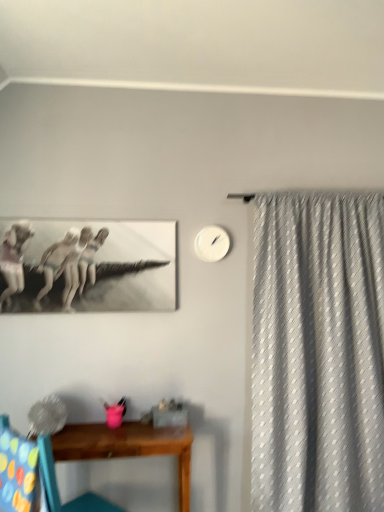
Question: In terms of width, does wooden chair at lower left look wider or thinner when compared to multicolored fabric swivel chair at lower left?

Choices:
 (A) thin
 (B) wide

Answer: (B)

Question: Based on their positions, is wooden chair at lower left located to the left or right of multicolored fabric swivel chair at lower left?

Choices:
 (A) right
 (B) left

Answer: (A)

Question: Estimate the real-world distances between objects in this image. Which object is farther from the wooden table at lower center?

Choices:
 (A) white matte clock at upper center
 (B) white textured curtain at right
 (C) wooden chair at lower left
 (D) multicolored fabric swivel chair at lower left

Answer: (A)

Question: Which object is the farthest from the wooden table at lower center?

Choices:
 (A) white matte clock at upper center
 (B) multicolored fabric swivel chair at lower left
 (C) wooden chair at lower left
 (D) white textured curtain at right

Answer: (A)